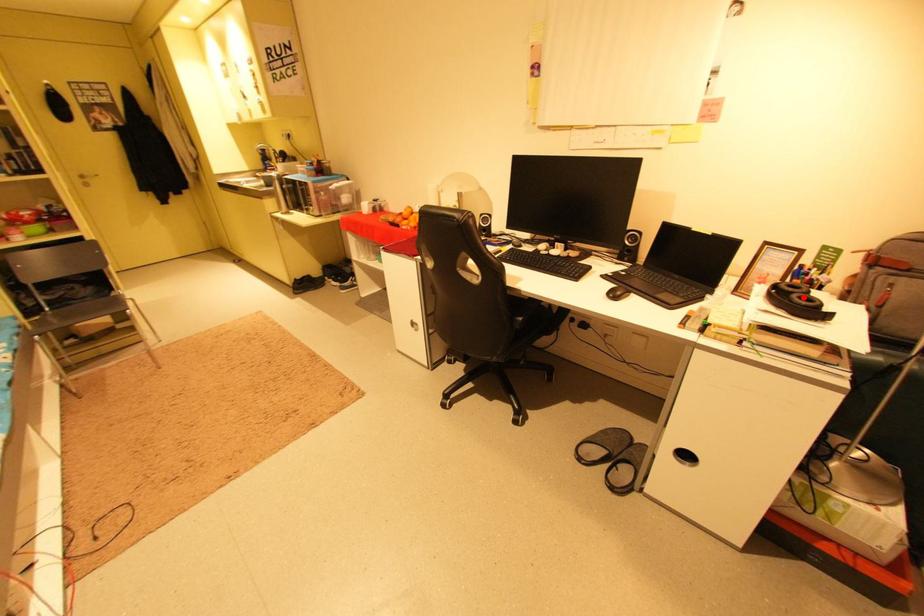
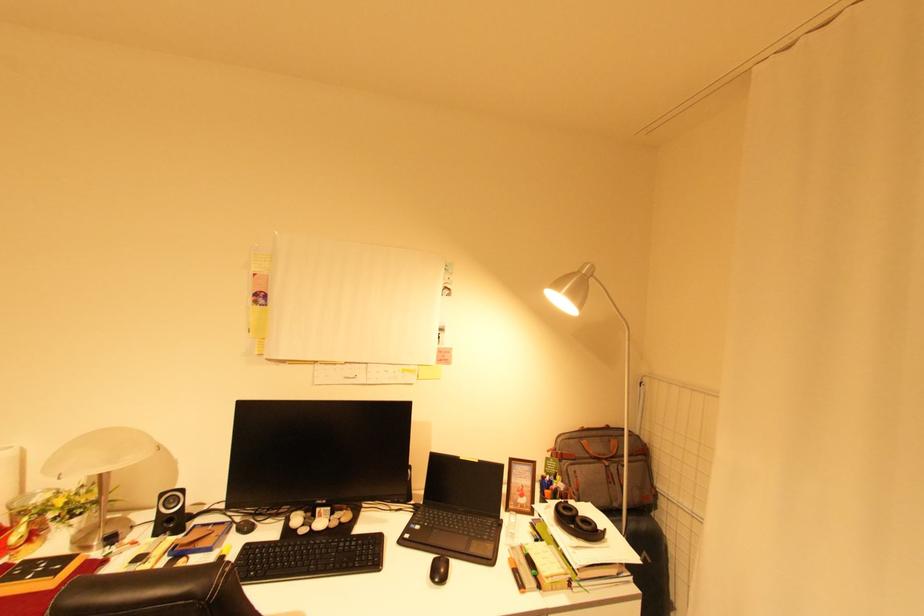
Find the pixel in the second image that matches the highlighted location in the first image.

(585, 521)